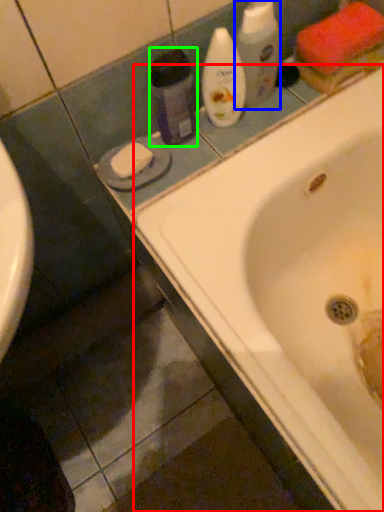
Question: Which object is positioned farthest from bathtub (highlighted by a red box)? Select from cleaning product (highlighted by a blue box) and cleaning product (highlighted by a green box).

Choices:
 (A) cleaning product
 (B) cleaning product

Answer: (A)